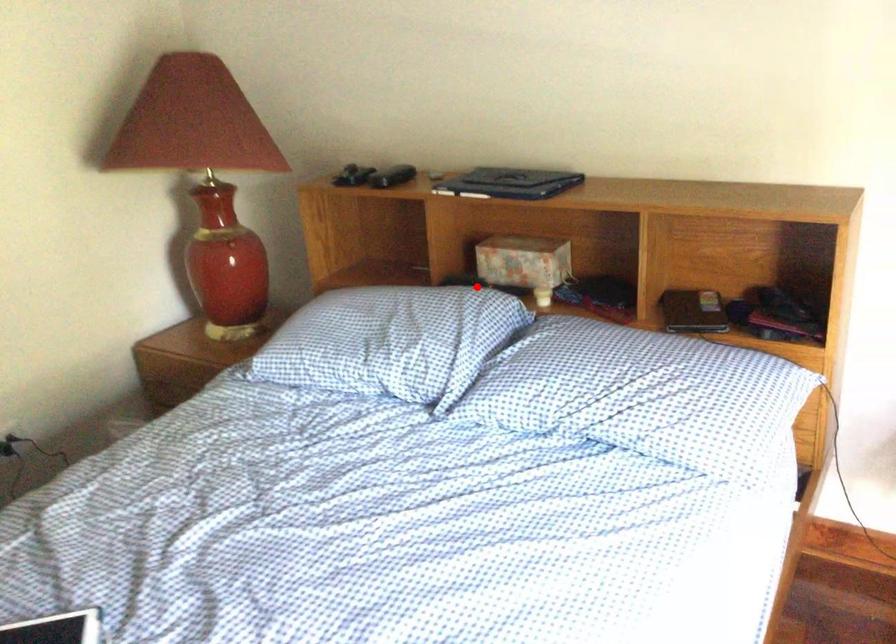
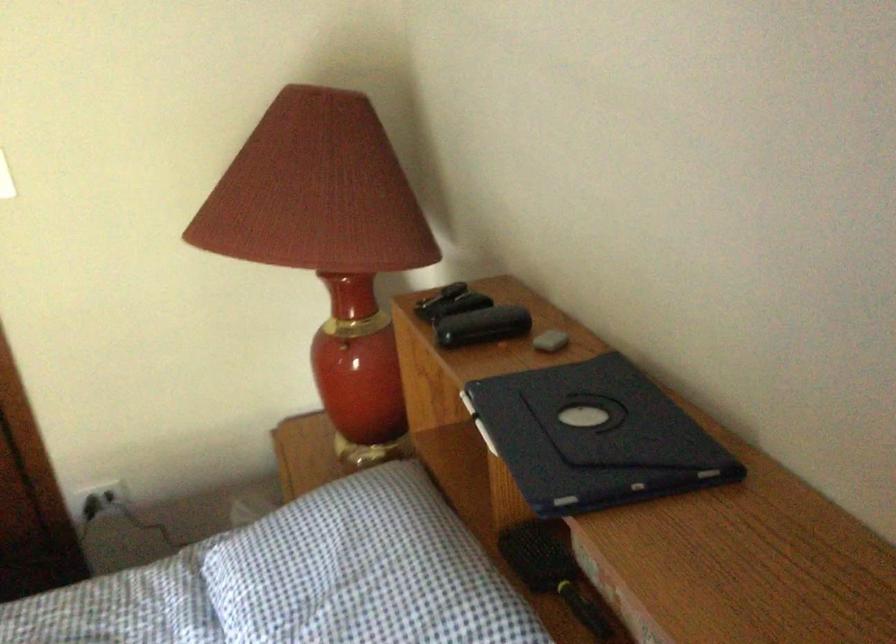
The point at the highlighted location is marked in the first image. Where is the corresponding point in the second image?

(552, 571)